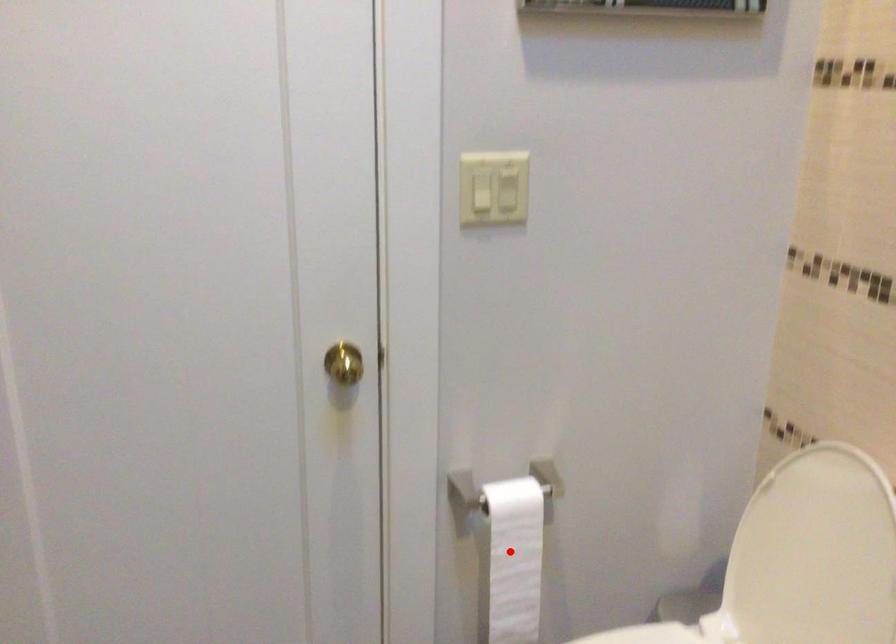
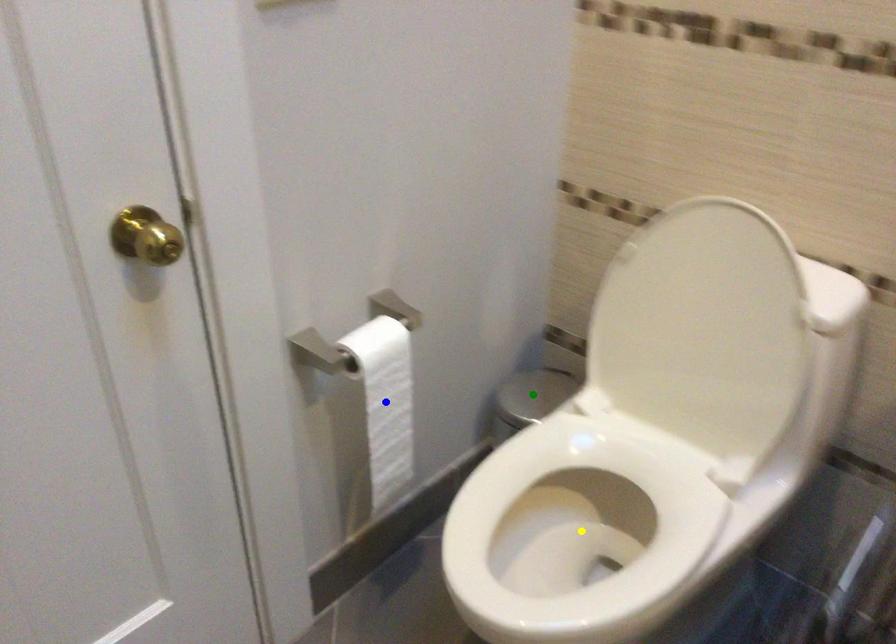
Question: I am providing you with two images of the same scene from different viewpoints. A red point is marked on the first image. You are given multiple points on the second image. Which spot in image 2 lines up with the point in image 1?

Choices:
 (A) blue point
 (B) green point
 (C) yellow point

Answer: (A)